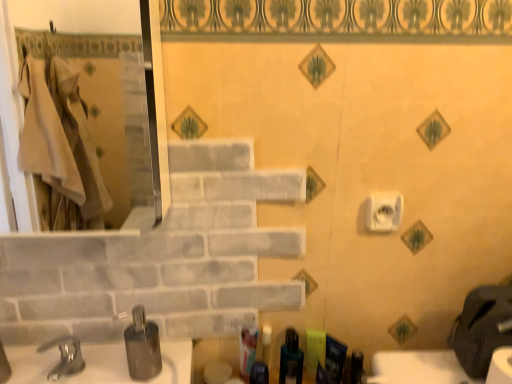
Describe the element at coordinates (259, 373) in the screenshot. This screenshot has width=512, height=384. I see `shiny dark blue bottle at center, which is the second toiletry from left to right` at that location.

What do you see at coordinates (384, 211) in the screenshot?
I see `white matte toilet paper at center right` at bounding box center [384, 211].

This screenshot has width=512, height=384. Identify the location of white matte toilet paper at center right. click(384, 211).

The image size is (512, 384). What are the coordinates of `metallic silver soap dispenser at lower left` in the screenshot? It's located at (142, 346).

Identify the location of matte glass mirror at left. The height and width of the screenshot is (384, 512). (71, 16).

What is the approximate width of silver metallic faucet at lower left?

silver metallic faucet at lower left is 5.27 inches in width.

In order to face white glossy toothpaste tube at center, the 1th toiletry from the left, should I rotate leftwards or rightwards?

It's best to rotate left around 0.741 degrees.

In the scene shown: Measure the distance between point (x=240, y=366) and camera.

The depth of point (x=240, y=366) is 3.49 feet.

Where is `shiny dark blue bottle at center, the fifth toiletry positioned from the right`? Image resolution: width=512 pixels, height=384 pixels. shiny dark blue bottle at center, the fifth toiletry positioned from the right is located at coordinates (259, 373).

From a real-world perspective, which object stands above the other?

In real-world perspective, metallic silver soap dispenser at lower left is above.

Which of these two, blue matte toothpaste tube at lower right, which is the 1th toiletry from right to left, or metallic silver soap dispenser at lower left, is wider?

With larger width is metallic silver soap dispenser at lower left.

Considering the sizes of blue matte toothpaste tube at lower right, which is the 6th toiletry in left-to-right order, and metallic silver soap dispenser at lower left in the image, is blue matte toothpaste tube at lower right, which is the 6th toiletry in left-to-right order, taller or shorter than metallic silver soap dispenser at lower left?

Considering their sizes, blue matte toothpaste tube at lower right, which is the 6th toiletry in left-to-right order, has less height than metallic silver soap dispenser at lower left.

Identify the location of soap dispenser above the blue matte toothpaste tube at lower right, which is the 1th toiletry from right to left (from the image's perspective). The width and height of the screenshot is (512, 384). (142, 346).

From their relative heights in the image, would you say translucent plastic toothbrush at lower center, positioned as the 3th toiletry in left-to-right order, is taller or shorter than blue matte toothpaste tube at lower right, which is the 6th toiletry in left-to-right order?

In the image, translucent plastic toothbrush at lower center, positioned as the 3th toiletry in left-to-right order, appears to be shorter than blue matte toothpaste tube at lower right, which is the 6th toiletry in left-to-right order.

Locate an element on the screen. Image resolution: width=512 pixels, height=384 pixels. the 1st toiletry above when counting from the blue matte toothpaste tube at lower right, which is the 6th toiletry in left-to-right order (from the image's perspective) is located at coordinates (266, 343).

Between translucent plastic toothbrush at lower center, positioned as the 3th toiletry in left-to-right order, and blue matte toothpaste tube at lower right, which is the 6th toiletry in left-to-right order, which one has smaller size?

Smaller between the two is translucent plastic toothbrush at lower center, positioned as the 3th toiletry in left-to-right order.

From the image's perspective, which object appears higher, translucent plastic toothbrush at lower center, positioned as the 3th toiletry in left-to-right order, or blue matte toothpaste tube at lower right, which is the 1th toiletry from right to left?

From the image's view, translucent plastic toothbrush at lower center, positioned as the 3th toiletry in left-to-right order, is above.

Is metallic silver soap dispenser at lower left at the back of white matte toilet paper at center right?

No.

Is metallic silver soap dispenser at lower left located within white matte toilet paper at center right?

No, metallic silver soap dispenser at lower left is not inside white matte toilet paper at center right.

Which is behind, point (400, 206) or point (129, 332)?

Point (400, 206)

Is white matte toilet paper at center right shorter than metallic silver soap dispenser at lower left?

Correct, white matte toilet paper at center right is not as tall as metallic silver soap dispenser at lower left.

Does point (268, 348) appear closer or farther from the camera than point (74, 341)?

Clearly, point (268, 348) is more distant from the camera than point (74, 341).

In terms of height, does translucent plastic toothbrush at lower center, the 4th toiletry viewed from the right, look taller or shorter compared to silver metallic faucet at lower left?

Clearly, translucent plastic toothbrush at lower center, the 4th toiletry viewed from the right, is taller compared to silver metallic faucet at lower left.

Is translucent plastic toothbrush at lower center, the 4th toiletry viewed from the right, bigger or smaller than silver metallic faucet at lower left?

Clearly, translucent plastic toothbrush at lower center, the 4th toiletry viewed from the right, is smaller in size than silver metallic faucet at lower left.

Is translucent plastic toothbrush at lower center, the 4th toiletry viewed from the right, to the right of silver metallic faucet at lower left from the viewer's perspective?

Yes, translucent plastic toothbrush at lower center, the 4th toiletry viewed from the right, is to the right of silver metallic faucet at lower left.

The width and height of the screenshot is (512, 384). Find the location of `tap above the white glossy toothpaste tube at center, the 1th toiletry from the left (from a real-world perspective)`. tap above the white glossy toothpaste tube at center, the 1th toiletry from the left (from a real-world perspective) is located at coordinates (65, 356).

Which of these two, silver metallic faucet at lower left or white glossy toothpaste tube at center, the 1th toiletry from the left, is thinner?

Thinner between the two is white glossy toothpaste tube at center, the 1th toiletry from the left.

Considering the positions of objects silver metallic faucet at lower left and white glossy toothpaste tube at center, the 1th toiletry from the left, in the image provided, who is behind, silver metallic faucet at lower left or white glossy toothpaste tube at center, the 1th toiletry from the left,?

white glossy toothpaste tube at center, the 1th toiletry from the left, is more distant.

Is white glossy toothpaste tube at center, the sixth toiletry in the right-to-left sequence, located outside translucent plastic toothbrush at lower center, the 4th toiletry viewed from the right?

white glossy toothpaste tube at center, the sixth toiletry in the right-to-left sequence, is positioned outside translucent plastic toothbrush at lower center, the 4th toiletry viewed from the right.

Would you consider white glossy toothpaste tube at center, the 1th toiletry from the left, to be distant from translucent plastic toothbrush at lower center, positioned as the 3th toiletry in left-to-right order?

That's not correct — white glossy toothpaste tube at center, the 1th toiletry from the left, is a little close to translucent plastic toothbrush at lower center, positioned as the 3th toiletry in left-to-right order.

Is white glossy toothpaste tube at center, the 1th toiletry from the left, bigger or smaller than translucent plastic toothbrush at lower center, positioned as the 3th toiletry in left-to-right order?

Considering their sizes, white glossy toothpaste tube at center, the 1th toiletry from the left, takes up more space than translucent plastic toothbrush at lower center, positioned as the 3th toiletry in left-to-right order.

Looking at this image, which object is positioned more to the left, white glossy toothpaste tube at center, the sixth toiletry in the right-to-left sequence, or translucent plastic toothbrush at lower center, positioned as the 3th toiletry in left-to-right order?

white glossy toothpaste tube at center, the sixth toiletry in the right-to-left sequence.

Does shiny dark blue bottle at center, which is the second toiletry from left to right, have a greater height compared to translucent plastic toothbrush at lower center, the 4th toiletry viewed from the right?

No, shiny dark blue bottle at center, which is the second toiletry from left to right, is not taller than translucent plastic toothbrush at lower center, the 4th toiletry viewed from the right.

Which of these two, shiny dark blue bottle at center, the fifth toiletry positioned from the right, or translucent plastic toothbrush at lower center, positioned as the 3th toiletry in left-to-right order, is thinner?

Thinner between the two is translucent plastic toothbrush at lower center, positioned as the 3th toiletry in left-to-right order.

Does shiny dark blue bottle at center, the fifth toiletry positioned from the right, have a smaller size compared to translucent plastic toothbrush at lower center, positioned as the 3th toiletry in left-to-right order?

Incorrect, shiny dark blue bottle at center, the fifth toiletry positioned from the right, is not smaller in size than translucent plastic toothbrush at lower center, positioned as the 3th toiletry in left-to-right order.

From a real-world perspective, which is physically below, shiny dark blue bottle at center, the fifth toiletry positioned from the right, or translucent plastic toothbrush at lower center, the 4th toiletry viewed from the right?

shiny dark blue bottle at center, the fifth toiletry positioned from the right, from a real-world perspective.

In order to click on toiletry that is the 2nd one when counting backward from the metallic silver soap dispenser at lower left in this screenshot , I will do `click(332, 362)`.

Where is `the 1st toiletry below the translucent plastic toothbrush at lower center, positioned as the 3th toiletry in left-to-right order (from the image's perspective)`? the 1st toiletry below the translucent plastic toothbrush at lower center, positioned as the 3th toiletry in left-to-right order (from the image's perspective) is located at coordinates (332, 362).

Estimate the real-world distances between objects in this image. Which object is closer to silver metallic faucet at lower left, matte glass mirror at left or metallic silver soap dispenser at lower left?

metallic silver soap dispenser at lower left is closer to silver metallic faucet at lower left.

Looking at the image, which one is located closer to translucent plastic toothbrush at lower center, which is counted as the 4th toiletry, starting from the left, translucent plastic toothbrush at lower center, positioned as the 3th toiletry in left-to-right order, or white glossy toothpaste tube at center, the sixth toiletry in the right-to-left sequence?

translucent plastic toothbrush at lower center, positioned as the 3th toiletry in left-to-right order.

When comparing their distances from white glossy toothpaste tube at center, the sixth toiletry in the right-to-left sequence, does blue matte toothpaste tube at lower right, which is the 1th toiletry from right to left, or shiny dark blue bottle at center, which is the second toiletry from left to right, seem closer?

shiny dark blue bottle at center, which is the second toiletry from left to right, is closer to white glossy toothpaste tube at center, the sixth toiletry in the right-to-left sequence.

From the image, which object appears to be nearer to matte glass mirror at left, blue matte toothpaste tube at lower right, which is the 1th toiletry from right to left, or metallic silver soap dispenser at lower left?

Among the two, metallic silver soap dispenser at lower left is located nearer to matte glass mirror at left.

Looking at the image, which one is located further to metallic silver soap dispenser at lower left, matte glass mirror at left or blue matte toothpaste tube at lower right, which is the 1th toiletry from right to left?

The object further to metallic silver soap dispenser at lower left is matte glass mirror at left.

When comparing their distances from translucent plastic toothbrush at lower center, the third toiletry positioned from the right, does matte glass mirror at left or white matte toilet paper at center right seem closer?

white matte toilet paper at center right is positioned closer to the anchor translucent plastic toothbrush at lower center, the third toiletry positioned from the right.

Based on their spatial positions, is matte glass mirror at left or metallic silver soap dispenser at lower left further from white glossy toothpaste tube at center, the 1th toiletry from the left?

Among the two, matte glass mirror at left is located further to white glossy toothpaste tube at center, the 1th toiletry from the left.

Based on their spatial positions, is blue matte toothpaste tube at lower right, which is the 1th toiletry from right to left, or silver metallic faucet at lower left closer to matte green soap dispenser at center, placed as the 5th toiletry when sorted from left to right?

blue matte toothpaste tube at lower right, which is the 1th toiletry from right to left, is positioned closer to the anchor matte green soap dispenser at center, placed as the 5th toiletry when sorted from left to right.

The image size is (512, 384). What are the coordinates of `soap dispenser between matte glass mirror at left and shiny dark blue bottle at center, which is the second toiletry from left to right, in the vertical direction` in the screenshot? It's located at (142, 346).

At what (x,y) coordinates should I click in order to perform the action: click on tap that lies between matte glass mirror at left and translucent plastic toothbrush at lower center, the third toiletry positioned from the right, from top to bottom. Please return your answer as a coordinate pair (x, y). This screenshot has height=384, width=512. Looking at the image, I should click on (65, 356).

Find the location of `soap dispenser situated between silver metallic faucet at lower left and matte green soap dispenser at center, which is the second toiletry in right-to-left order, from left to right`. soap dispenser situated between silver metallic faucet at lower left and matte green soap dispenser at center, which is the second toiletry in right-to-left order, from left to right is located at coordinates (142, 346).

The height and width of the screenshot is (384, 512). Identify the location of soap dispenser between silver metallic faucet at lower left and white glossy toothpaste tube at center, the sixth toiletry in the right-to-left sequence. 142,346.